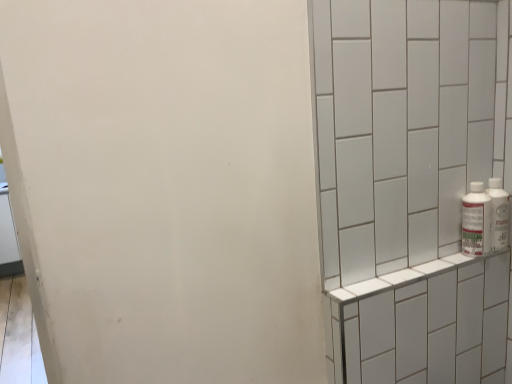
At what (x,y) coordinates should I click in order to perform the action: click on free space above white tile shelf at right (from a real-world perspective). Please return your answer as a coordinate pair (x, y). Looking at the image, I should click on (423, 268).